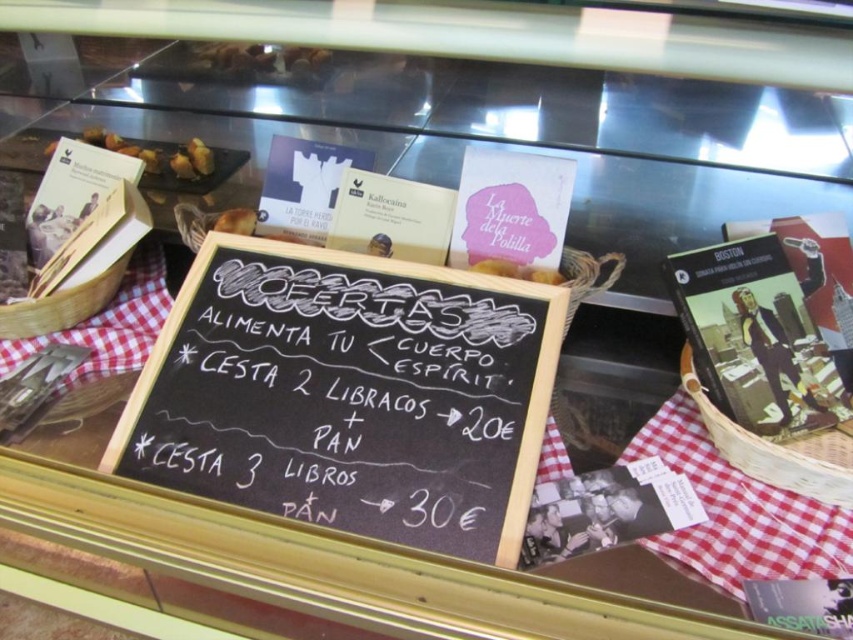
You are a customer standing in front of the display case and want to read the chalkboard sign. Can you see the golden brown bread at center behind the black chalkboard at center?

The black chalkboard at center is much taller than the golden brown bread at center, so the chalkboard is blocking the view of the bread behind it.

You are a customer at the bakery and want to choose between the golden brown bread at center and the matte brown bread at upper left. Which bread is wider?

The golden brown bread at center is wider than the matte brown bread at upper left because its width surpasses the other.

You are a customer in the bakery and want to read the sign on the black chalkboard at center. However, there is a golden brown bread at center blocking your view. Can you see the entire chalkboard sign?

The black chalkboard at center is bigger than golden brown bread at center, so the bread is smaller and might not fully block the chalkboard. You should still be able to see most of the sign.